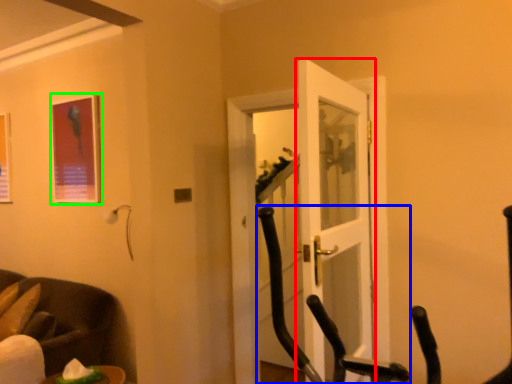
Question: Which object is the closest to the door (highlighted by a red box)? Choose among these: rocking chair (highlighted by a blue box) or picture frame (highlighted by a green box).

Choices:
 (A) rocking chair
 (B) picture frame

Answer: (A)